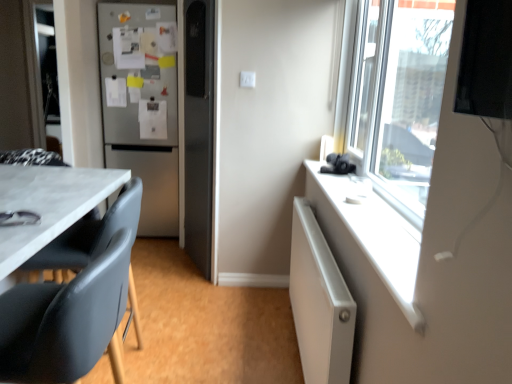
Locate an element on the screen. free location above white plastic window sill at upper right (from a real-world perspective) is located at coordinates [348, 190].